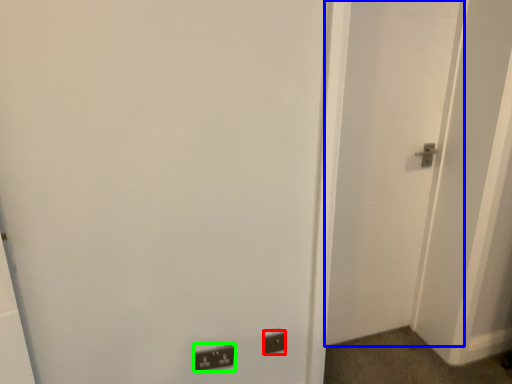
Question: Based on their relative distances, which object is nearer to electric outlet (highlighted by a red box)? Choose from door (highlighted by a blue box) and light switch (highlighted by a green box).

Choices:
 (A) door
 (B) light switch

Answer: (B)